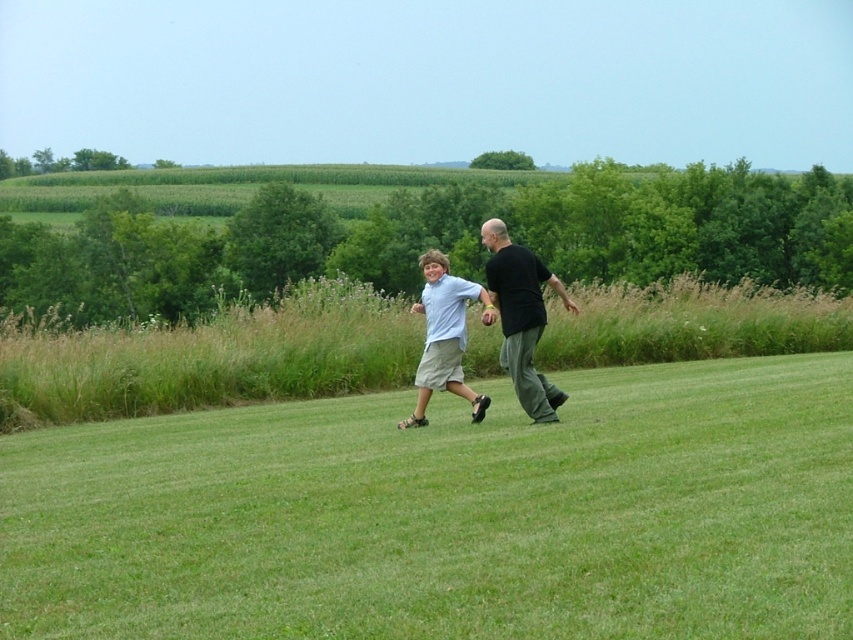
Between green grassy field at center and black matte shirt at center, which one has more height?

With more height is black matte shirt at center.

Does green grassy field at center come behind black matte shirt at center?

No.

Does point (592, 627) come farther from viewer compared to point (540, 292)?

No, it is in front of (540, 292).

Locate an element on the screen. Image resolution: width=853 pixels, height=640 pixels. green grassy field at center is located at coordinates (450, 515).

Describe the element at coordinates (450, 515) in the screenshot. I see `green grassy field at center` at that location.

Between point (610, 390) and point (438, 330), which one is positioned behind?

Positioned behind is point (610, 390).

Where is `green grassy field at center`? The width and height of the screenshot is (853, 640). green grassy field at center is located at coordinates (450, 515).

Consider the image. Between black matte shirt at center and light blue cotton shirt at center, which one is positioned higher?

black matte shirt at center is higher up.

Is point (576, 308) in front of point (461, 312)?

Yes.

Identify the location of black matte shirt at center. The image size is (853, 640). (521, 317).